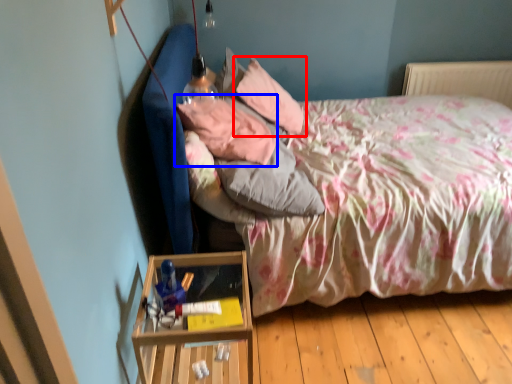
Question: Which point is closer to the camera, pillow (highlighted by a red box) or pillow (highlighted by a blue box)?

Choices:
 (A) pillow
 (B) pillow

Answer: (B)